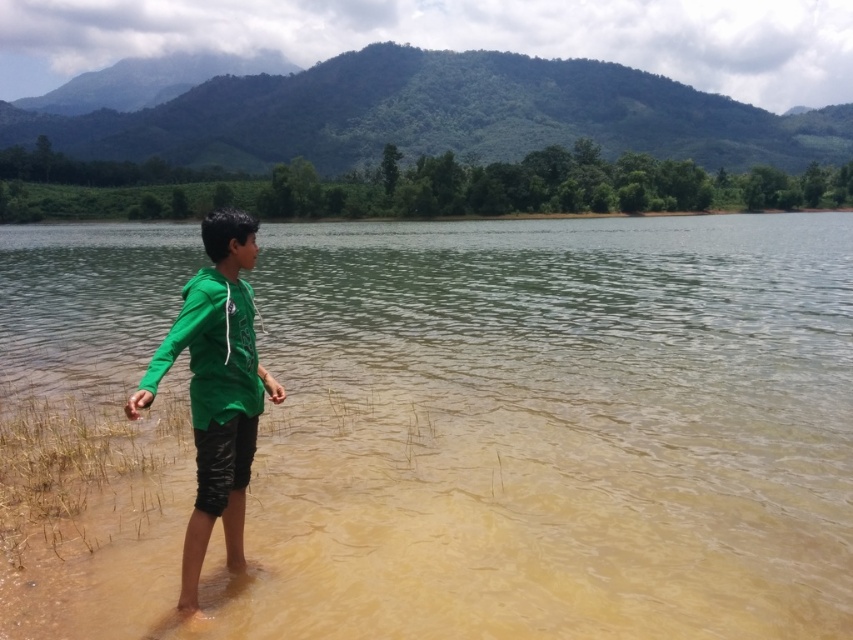
Question: Can you confirm if brown muddy water at center is wider than green matte hoodie at center?

Choices:
 (A) yes
 (B) no

Answer: (A)

Question: Which point appears farthest from the camera in this image?

Choices:
 (A) (775, 532)
 (B) (192, 593)

Answer: (A)

Question: Is brown muddy water at center thinner than green matte hoodie at center?

Choices:
 (A) no
 (B) yes

Answer: (A)

Question: Which object appears farthest from the camera in this image?

Choices:
 (A) green matte hoodie at center
 (B) brown muddy water at center

Answer: (A)

Question: Does brown muddy water at center have a larger size compared to green matte hoodie at center?

Choices:
 (A) no
 (B) yes

Answer: (B)